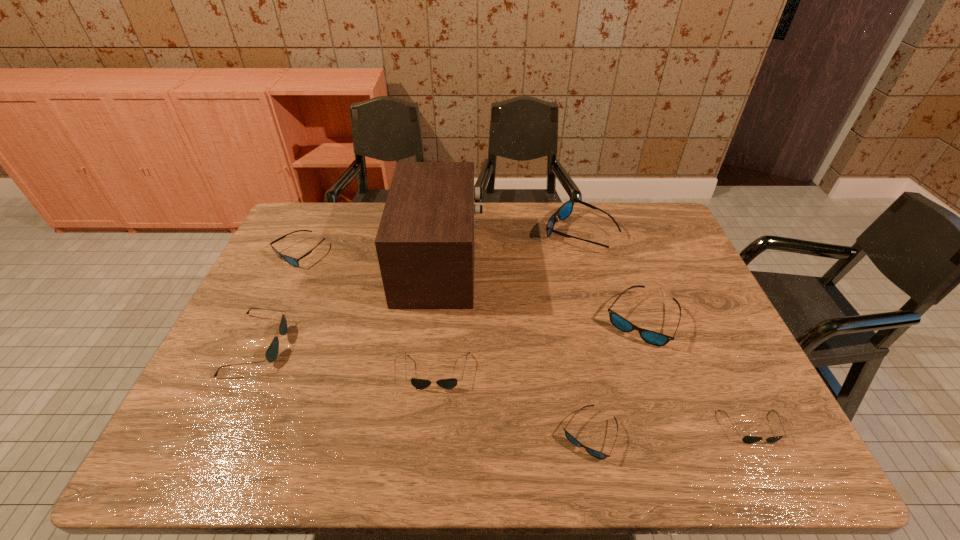
The height and width of the screenshot is (540, 960). Identify the location of object situated at the far left corner. (292, 261).

You are a GUI agent. You are given a task and a screenshot of the screen. Output one action in this format:
    pyautogui.click(x=<x>, y=<y>)
    Task: Click on the object at the near right corner
    
    Given the screenshot: What is the action you would take?
    pyautogui.click(x=747, y=439)

The width and height of the screenshot is (960, 540). I want to click on free space at the far edge, so click(x=532, y=225).

Locate an element on the screen. The width and height of the screenshot is (960, 540). vacant region at the near edge of the desktop is located at coordinates (542, 441).

You are a GUI agent. You are given a task and a screenshot of the screen. Output one action in this format:
    pyautogui.click(x=<x>, y=<y>)
    Task: Click on the free space at the left edge of the desktop
    The image size is (960, 540).
    Given the screenshot: What is the action you would take?
    pyautogui.click(x=278, y=261)

Identify the location of vacant region at the right edge of the desktop. click(x=676, y=326).

Image resolution: width=960 pixels, height=540 pixels. I want to click on free spot at the far left corner of the desktop, so click(x=329, y=227).

In the image, there is a desktop. Identify the location of vacant space at the far right corner. This screenshot has height=540, width=960. (643, 238).

Identify the location of free space at the near right corner of the desktop. (780, 430).

Find the location of a particular element. vacant space that is in between the smallest black sunglasses and the second smallest black sunglasses is located at coordinates [x=594, y=400].